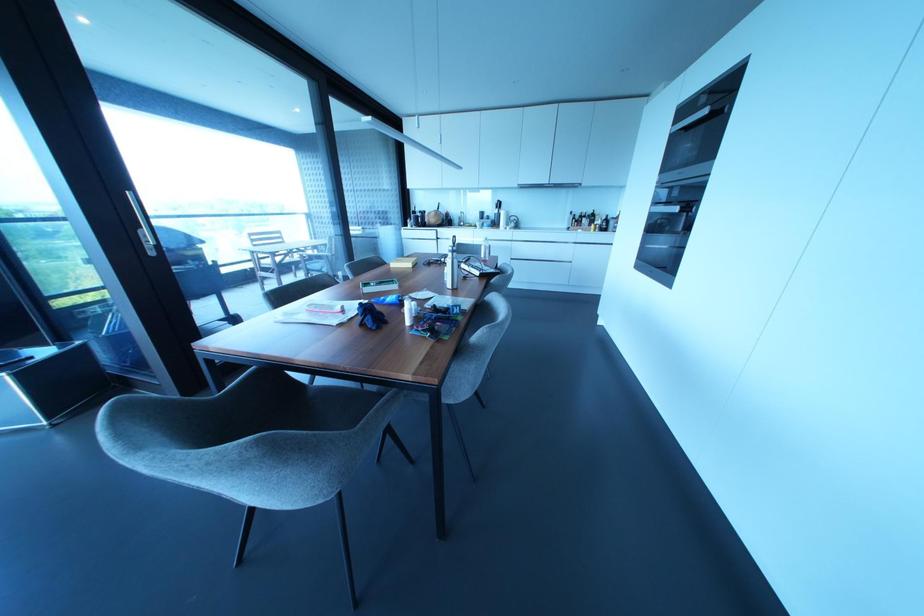
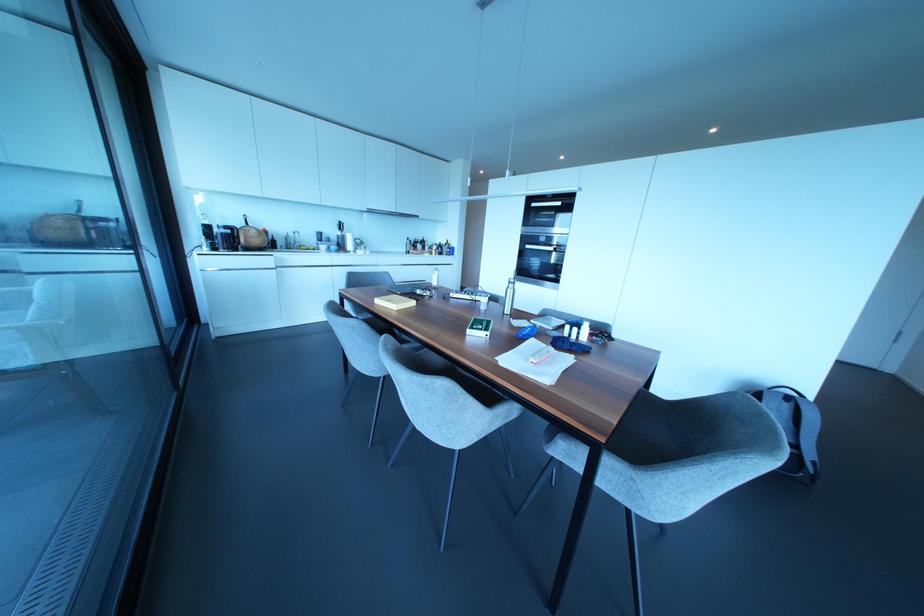
Find the pixel in the second image that matches point (448, 284) in the first image.

(506, 310)